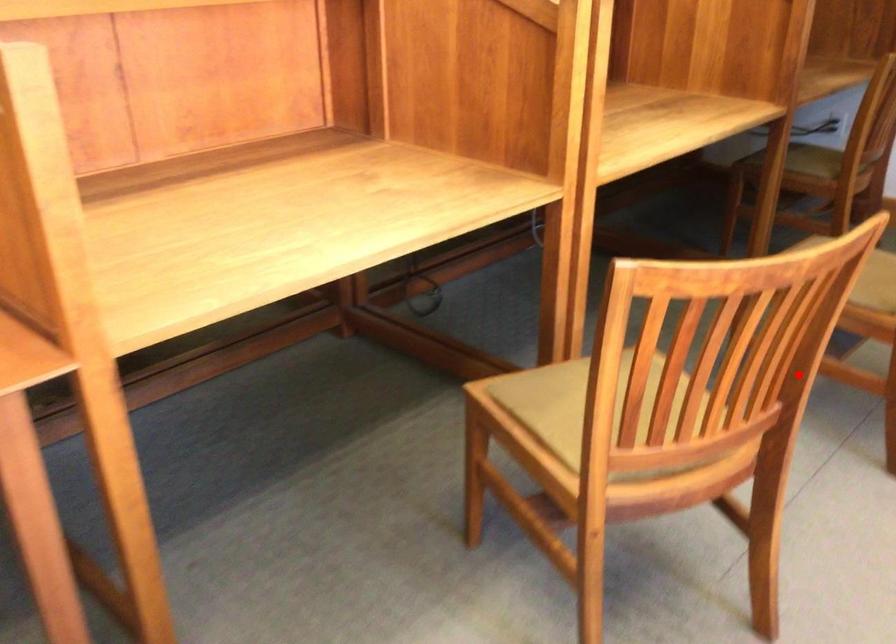
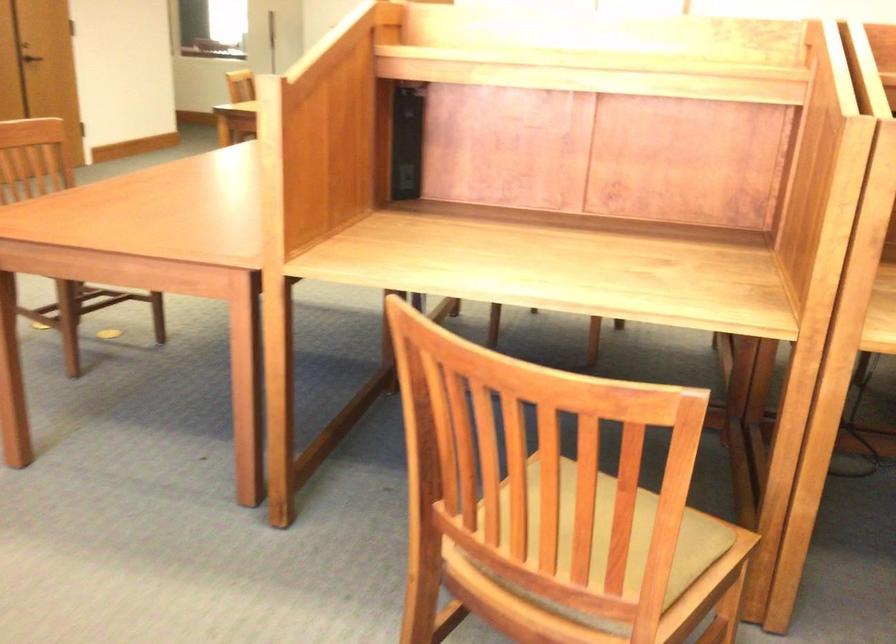
Question: I am providing you with two images of the same scene from different viewpoints. A red point is shown in image1. For the corresponding object point in image2, is it positioned nearer or farther from the camera?

Choices:
 (A) Nearer
 (B) Farther

Answer: (A)